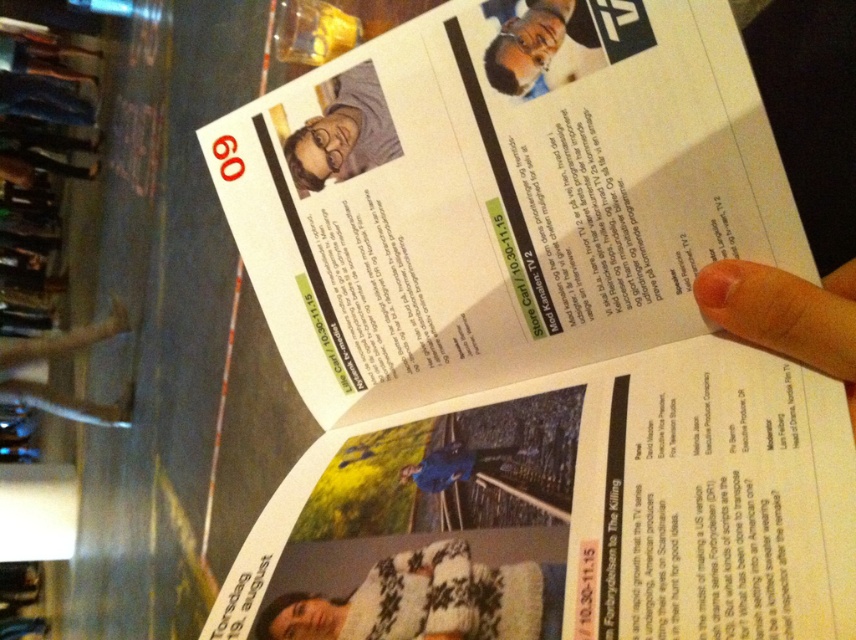
Is point (550, 3) positioned before point (393, 145)?

Yes.

Which of these two, matte black face at upper center or matte gray shirt at upper center, stands taller?

With more height is matte gray shirt at upper center.

Where is `matte black face at upper center`? matte black face at upper center is located at coordinates (539, 45).

I want to click on matte black face at upper center, so click(539, 45).

Is point (530, 561) positioned behind point (321, 125)?

That is False.

Between point (278, 605) and point (361, 154), which one is positioned behind?

The point (361, 154) is more distant.

Locate an element on the screen. white knitted sweater at lower center is located at coordinates (428, 600).

Looking at this image, can you confirm if flesh-toned skin at upper right is shorter than matte gray shirt at upper center?

Incorrect, flesh-toned skin at upper right's height does not fall short of matte gray shirt at upper center's.

Based on the photo, who is more distant from viewer, (767, 305) or (375, 81)?

The point (375, 81) is behind.

This screenshot has height=640, width=856. What are the coordinates of `flesh-toned skin at upper right` in the screenshot? It's located at (786, 314).